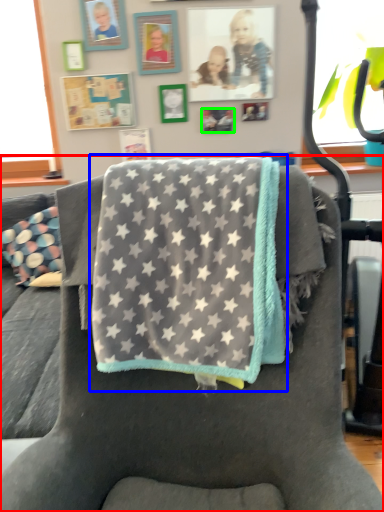
Question: Considering the real-world distances, which object is closest to chair (highlighted by a red box)? beach towel (highlighted by a blue box) or picture frame (highlighted by a green box).

Choices:
 (A) beach towel
 (B) picture frame

Answer: (A)